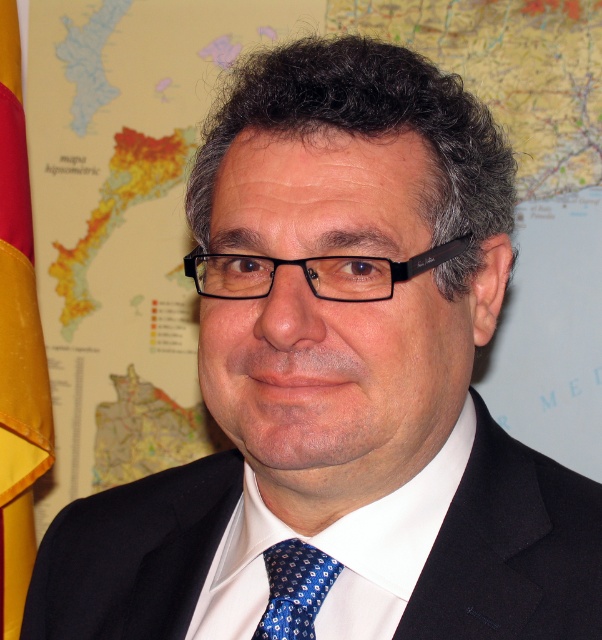
Is black textured suit at center to the left of blue silk tie at center from the viewer's perspective?

Correct, you'll find black textured suit at center to the left of blue silk tie at center.

Who is more forward, [559,504] or [308,600]?

Point [308,600]

Locate an element on the screen. black textured suit at center is located at coordinates (510, 548).

Who is taller, white smooth dress shirt at center or blue silk tie at center?

With more height is white smooth dress shirt at center.

Is point (411, 524) in front of point (314, 595)?

That is False.

This screenshot has height=640, width=602. Find the location of `white smooth dress shirt at center`. white smooth dress shirt at center is located at coordinates (337, 552).

You are a GUI agent. You are given a task and a screenshot of the screen. Output one action in this format:
    pyautogui.click(x=<x>, y=<y>)
    Task: Click on the black plastic glasses at center
    This screenshot has width=602, height=640.
    Given the screenshot: What is the action you would take?
    pyautogui.click(x=312, y=273)

Is black plastic glasses at center positioned before blue silk tie at center?

Yes, it is in front of blue silk tie at center.

Image resolution: width=602 pixels, height=640 pixels. What are the coordinates of `black plastic glasses at center` in the screenshot? It's located at (312, 273).

Identify the location of black plastic glasses at center. This screenshot has width=602, height=640. (312, 273).